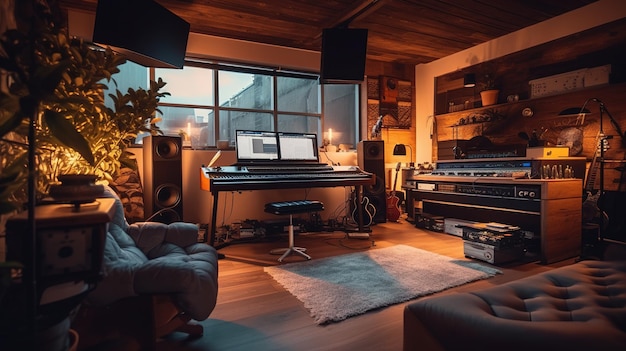
Where is `keyboard`? keyboard is located at coordinates (268, 174).